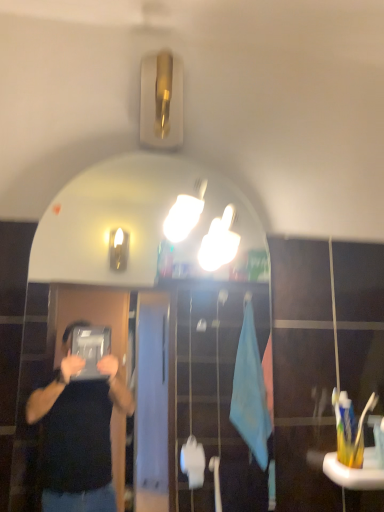
Locate an element on the screen. yellow plastic toothbrush at lower right, positioned as the 2th toothbrush in left-to-right order is located at coordinates (345, 429).

At what (x,y) coordinates should I click in order to perform the action: click on white glossy mirror at upper center. Please return your answer as a coordinate pair (x, y). Looking at the image, I should click on (143, 225).

In order to face yellow plastic toothbrush at lower right, the first toothbrush viewed from the right, should I rotate leftwards or rightwards?

You should look right and rotate roughly 22.279 degrees.

I want to click on white plastic toothbrush at right, which is counted as the 1th toothbrush, starting from the left, so click(342, 425).

Considering the sizes of white glossy mirror at upper center and yellow plastic toothbrush at lower right, the first toothbrush viewed from the right, in the image, is white glossy mirror at upper center wider or thinner than yellow plastic toothbrush at lower right, the first toothbrush viewed from the right,?

In the image, white glossy mirror at upper center appears to be more narrow than yellow plastic toothbrush at lower right, the first toothbrush viewed from the right.

Can yellow plastic toothbrush at lower right, the first toothbrush viewed from the right, be found inside white glossy mirror at upper center?

That's incorrect, yellow plastic toothbrush at lower right, the first toothbrush viewed from the right, is not inside white glossy mirror at upper center.

From the image's perspective, count 1st toothbrushs downward from the white glossy mirror at upper center and point to it. Please provide its 2D coordinates.

[(363, 422)]

Is the position of white glossy mirror at upper center less distant than that of yellow plastic toothbrush at lower right, the first toothbrush viewed from the right?

Yes.

Considering the relative sizes of yellow plastic toothbrush at lower right, the first toothbrush viewed from the right, and yellow plastic toothbrush at lower right, the second toothbrush from the right, in the image provided, is yellow plastic toothbrush at lower right, the first toothbrush viewed from the right, bigger than yellow plastic toothbrush at lower right, the second toothbrush from the right,?

Correct, yellow plastic toothbrush at lower right, the first toothbrush viewed from the right, is larger in size than yellow plastic toothbrush at lower right, the second toothbrush from the right.

How many degrees apart are the facing directions of yellow plastic toothbrush at lower right, the first toothbrush viewed from the right, and yellow plastic toothbrush at lower right, positioned as the 2th toothbrush in left-to-right order?

The angle between the facing direction of yellow plastic toothbrush at lower right, the first toothbrush viewed from the right, and the facing direction of yellow plastic toothbrush at lower right, positioned as the 2th toothbrush in left-to-right order, is 90 degrees.

Could you measure the distance between yellow plastic toothbrush at lower right, the first toothbrush viewed from the right, and yellow plastic toothbrush at lower right, the second toothbrush from the right?

They are 1.25 inches apart.

From the image's perspective, is yellow plastic toothbrush at lower right, the third toothbrush from the left, located above or below yellow plastic toothbrush at lower right, the second toothbrush from the right?

yellow plastic toothbrush at lower right, the third toothbrush from the left, is situated higher than yellow plastic toothbrush at lower right, the second toothbrush from the right, in the image.

Is white glossy mirror at upper center not within white plastic toothbrush at right, the 3th toothbrush from the right?

white glossy mirror at upper center lies outside white plastic toothbrush at right, the 3th toothbrush from the right,'s area.

How distant is white glossy mirror at upper center from white plastic toothbrush at right, which is counted as the 1th toothbrush, starting from the left?

white glossy mirror at upper center is 6.19 feet away from white plastic toothbrush at right, which is counted as the 1th toothbrush, starting from the left.

Considering the relative sizes of white glossy mirror at upper center and white plastic toothbrush at right, the 3th toothbrush from the right, in the image provided, is white glossy mirror at upper center thinner than white plastic toothbrush at right, the 3th toothbrush from the right,?

Incorrect, the width of white glossy mirror at upper center is not less than that of white plastic toothbrush at right, the 3th toothbrush from the right.

Which is behind, white glossy mirror at upper center or white plastic toothbrush at right, which is counted as the 1th toothbrush, starting from the left?

white plastic toothbrush at right, which is counted as the 1th toothbrush, starting from the left, is more distant.

From the picture: In the image, is white plastic toothbrush at right, which is counted as the 1th toothbrush, starting from the left, on the left side or the right side of white glossy mirror at upper center?

white plastic toothbrush at right, which is counted as the 1th toothbrush, starting from the left, is to the right of white glossy mirror at upper center.

Would you say white glossy mirror at upper center is part of white plastic toothbrush at right, which is counted as the 1th toothbrush, starting from the left,'s contents?

Actually, white glossy mirror at upper center is outside white plastic toothbrush at right, which is counted as the 1th toothbrush, starting from the left.

In terms of width, does white plastic toothbrush at right, which is counted as the 1th toothbrush, starting from the left, look wider or thinner when compared to white glossy mirror at upper center?

In the image, white plastic toothbrush at right, which is counted as the 1th toothbrush, starting from the left, appears to be more narrow than white glossy mirror at upper center.

From a real-world perspective, is white plastic toothbrush at right, the 3th toothbrush from the right, physically below white glossy mirror at upper center?

Yes, from a real-world perspective, white plastic toothbrush at right, the 3th toothbrush from the right, is beneath white glossy mirror at upper center.

From a real-world perspective, who is located higher, yellow plastic toothbrush at lower right, the second toothbrush from the right, or white glossy mirror at upper center?

white glossy mirror at upper center, from a real-world perspective.

From the image's perspective, which object appears higher, yellow plastic toothbrush at lower right, the second toothbrush from the right, or white glossy mirror at upper center?

white glossy mirror at upper center.

From the picture: Which of these two, yellow plastic toothbrush at lower right, the first toothbrush viewed from the right, or white glossy mirror at upper center, is smaller?

Smaller between the two is yellow plastic toothbrush at lower right, the first toothbrush viewed from the right.

Consider the image. Would you say white glossy mirror at upper center is part of yellow plastic toothbrush at lower right, the first toothbrush viewed from the right,'s contents?

No, white glossy mirror at upper center is located outside of yellow plastic toothbrush at lower right, the first toothbrush viewed from the right.

From the image's perspective, would you say yellow plastic toothbrush at lower right, the first toothbrush viewed from the right, is positioned over white glossy mirror at upper center?

Incorrect, from the image's perspective, yellow plastic toothbrush at lower right, the first toothbrush viewed from the right, is lower than white glossy mirror at upper center.

From the image's perspective, is yellow plastic toothbrush at lower right, positioned as the 2th toothbrush in left-to-right order, over white plastic toothbrush at right, the 3th toothbrush from the right?

No, from the image's perspective, yellow plastic toothbrush at lower right, positioned as the 2th toothbrush in left-to-right order, is not over white plastic toothbrush at right, the 3th toothbrush from the right.

Between yellow plastic toothbrush at lower right, positioned as the 2th toothbrush in left-to-right order, and white plastic toothbrush at right, the 3th toothbrush from the right, which one has smaller size?

white plastic toothbrush at right, the 3th toothbrush from the right, is smaller.

Would you say yellow plastic toothbrush at lower right, the second toothbrush from the right, contains white plastic toothbrush at right, which is counted as the 1th toothbrush, starting from the left?

Yes, yellow plastic toothbrush at lower right, the second toothbrush from the right, is surrounding white plastic toothbrush at right, which is counted as the 1th toothbrush, starting from the left.

Is yellow plastic toothbrush at lower right, the second toothbrush from the right, at the right side of white plastic toothbrush at right, which is counted as the 1th toothbrush, starting from the left?

Indeed, yellow plastic toothbrush at lower right, the second toothbrush from the right, is positioned on the right side of white plastic toothbrush at right, which is counted as the 1th toothbrush, starting from the left.

Which toothbrush is the 1st one when counting from the back of the white glossy mirror at upper center? Please provide its 2D coordinates.

[(363, 422)]

Find the location of a particular element. This screenshot has height=512, width=384. toothbrush below the yellow plastic toothbrush at lower right, the third toothbrush from the left (from a real-world perspective) is located at coordinates (345, 429).

Which object lies further to the anchor point white glossy mirror at upper center, yellow plastic toothbrush at lower right, the first toothbrush viewed from the right, or white plastic toothbrush at right, which is counted as the 1th toothbrush, starting from the left?

The object further to white glossy mirror at upper center is yellow plastic toothbrush at lower right, the first toothbrush viewed from the right.

Estimate the real-world distances between objects in this image. Which object is closer to white glossy mirror at upper center, white plastic toothbrush at right, the 3th toothbrush from the right, or yellow plastic toothbrush at lower right, the second toothbrush from the right?

Among the two, white plastic toothbrush at right, the 3th toothbrush from the right, is located nearer to white glossy mirror at upper center.

Considering their positions, is white glossy mirror at upper center positioned further to white plastic toothbrush at right, which is counted as the 1th toothbrush, starting from the left, than yellow plastic toothbrush at lower right, positioned as the 2th toothbrush in left-to-right order?

white glossy mirror at upper center lies further to white plastic toothbrush at right, which is counted as the 1th toothbrush, starting from the left, than the other object.

Estimate the real-world distances between objects in this image. Which object is further from white glossy mirror at upper center, white plastic toothbrush at right, which is counted as the 1th toothbrush, starting from the left, or yellow plastic toothbrush at lower right, the first toothbrush viewed from the right?

yellow plastic toothbrush at lower right, the first toothbrush viewed from the right, is further to white glossy mirror at upper center.

When comparing their distances from white plastic toothbrush at right, the 3th toothbrush from the right, does white glossy mirror at upper center or yellow plastic toothbrush at lower right, the first toothbrush viewed from the right, seem closer?

yellow plastic toothbrush at lower right, the first toothbrush viewed from the right, is closer to white plastic toothbrush at right, the 3th toothbrush from the right.

Considering their positions, is yellow plastic toothbrush at lower right, positioned as the 2th toothbrush in left-to-right order, positioned closer to white plastic toothbrush at right, the 3th toothbrush from the right, than yellow plastic toothbrush at lower right, the third toothbrush from the left?

yellow plastic toothbrush at lower right, positioned as the 2th toothbrush in left-to-right order.

From the image, which object appears to be nearer to yellow plastic toothbrush at lower right, the first toothbrush viewed from the right, yellow plastic toothbrush at lower right, the second toothbrush from the right, or white glossy mirror at upper center?

yellow plastic toothbrush at lower right, the second toothbrush from the right, is closer to yellow plastic toothbrush at lower right, the first toothbrush viewed from the right.

Considering their positions, is white glossy mirror at upper center positioned closer to yellow plastic toothbrush at lower right, the third toothbrush from the left, than yellow plastic toothbrush at lower right, the second toothbrush from the right?

yellow plastic toothbrush at lower right, the second toothbrush from the right.

I want to click on toothbrush between white plastic toothbrush at right, the 3th toothbrush from the right, and yellow plastic toothbrush at lower right, the first toothbrush viewed from the right, from left to right, so click(345, 429).

Find the location of a particular element. Image resolution: width=384 pixels, height=512 pixels. toothbrush between white glossy mirror at upper center and yellow plastic toothbrush at lower right, positioned as the 2th toothbrush in left-to-right order is located at coordinates (342, 425).